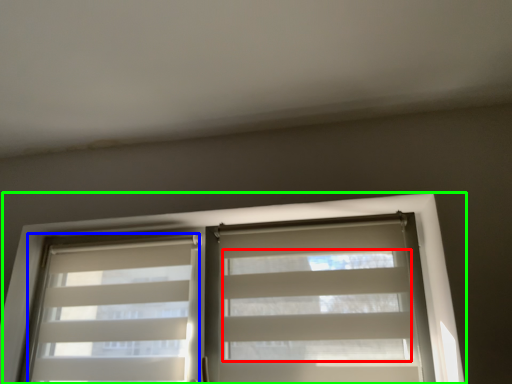
Question: Based on their relative distances, which object is nearer to blind (highlighted by a red box)? Choose from shutter (highlighted by a blue box) and window (highlighted by a green box).

Choices:
 (A) shutter
 (B) window

Answer: (B)